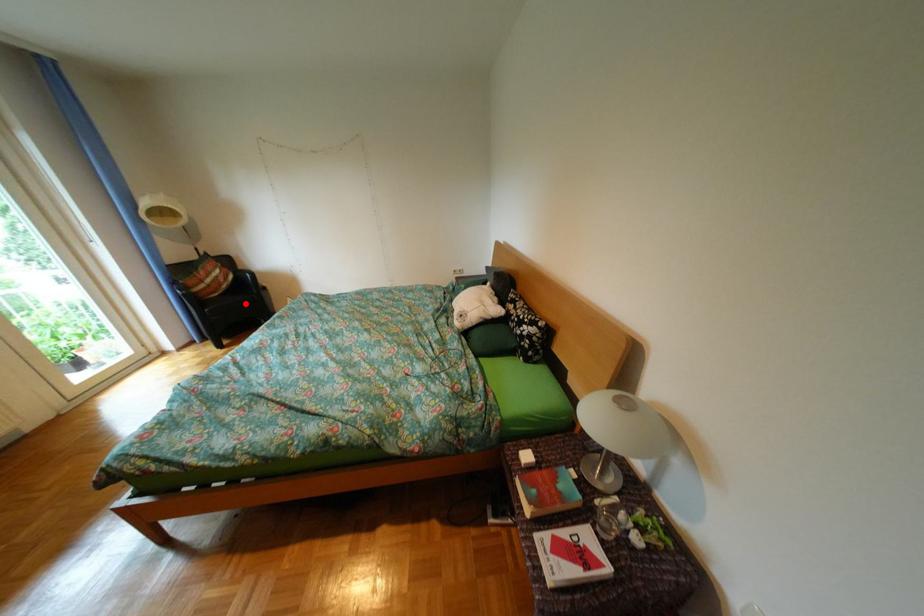
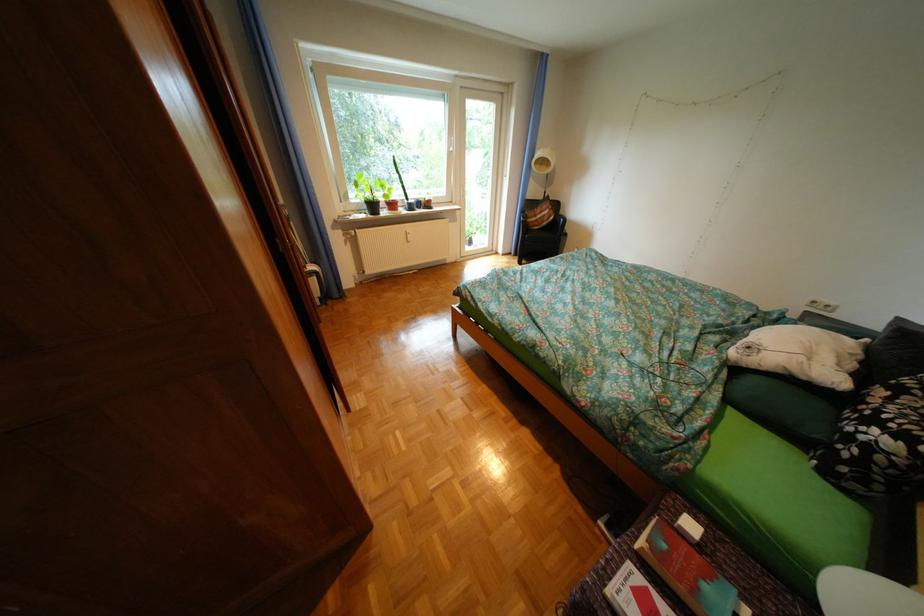
Where in the second image is the point corresponding to the highlighted location from the first image?

(555, 238)